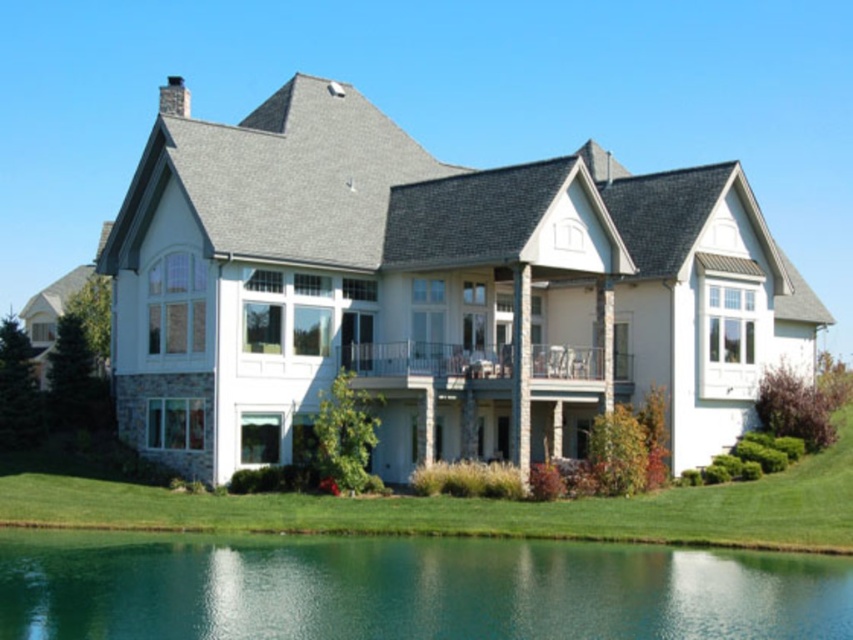
You are standing on the balcony of the house and looking down at the green liquid water at lower center and the green grass at lower center. Which one is closer to the balcony?

The green grass at lower center is closer to the balcony because the green liquid water at lower center is positioned under it.

You are standing at the front door of the house and want to pour a drink into the green liquid water at lower center. Can you reach it from where you are standing?

The green liquid water at lower center is located at coordinates point (x=407, y=589), which is likely too far from the front door to reach directly. You would need to move closer to access it.